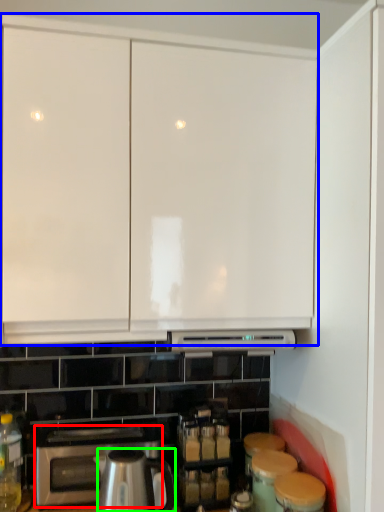
Question: Which object is the farthest from home appliance (highlighted by a red box)? Choose among these: cabinetry (highlighted by a blue box) or kitchen appliance (highlighted by a green box).

Choices:
 (A) cabinetry
 (B) kitchen appliance

Answer: (A)